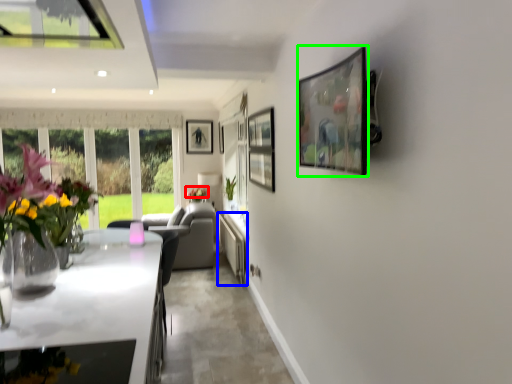
Question: Estimate the real-world distances between objects in this image. Which object is closer to flower (highlighted by a red box), counter top (highlighted by a blue box) or picture frame (highlighted by a green box)?

Choices:
 (A) counter top
 (B) picture frame

Answer: (A)